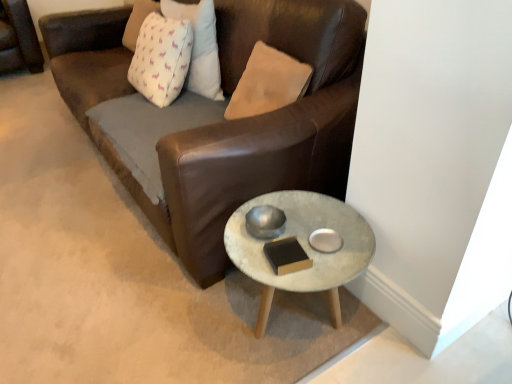
Image resolution: width=512 pixels, height=384 pixels. What do you see at coordinates (303, 248) in the screenshot?
I see `marble-coated coffee table at lower right` at bounding box center [303, 248].

Identify the location of marble-coated coffee table at lower right. The height and width of the screenshot is (384, 512). (303, 248).

The image size is (512, 384). In order to click on white fabric pillow at upper left in this screenshot , I will do `click(200, 46)`.

What do you see at coordinates (200, 46) in the screenshot?
I see `white fabric pillow at upper left` at bounding box center [200, 46].

Where is `marble-coated coffee table at lower right`? The width and height of the screenshot is (512, 384). marble-coated coffee table at lower right is located at coordinates (303, 248).

Considering the positions of objects marble-coated coffee table at lower right and white fabric pillow at upper left in the image provided, who is more to the right, marble-coated coffee table at lower right or white fabric pillow at upper left?

marble-coated coffee table at lower right.

Considering the relative positions of marble-coated coffee table at lower right and white fabric pillow at upper left in the image provided, is marble-coated coffee table at lower right behind white fabric pillow at upper left?

No, it is not.

Is point (266, 295) farther from camera compared to point (162, 8)?

No, it is not.

From the image's perspective, between marble-coated coffee table at lower right and white fabric pillow at upper left, who is located below?

marble-coated coffee table at lower right appears lower in the image.

From a real-world perspective, is marble-coated coffee table at lower right above or below white fabric pillow at upper left?

In terms of real-world spatial position, marble-coated coffee table at lower right is below white fabric pillow at upper left.

Does marble-coated coffee table at lower right have a greater width compared to white fabric pillow at upper left?

Indeed, marble-coated coffee table at lower right has a greater width compared to white fabric pillow at upper left.

Considering the sizes of objects marble-coated coffee table at lower right and white fabric pillow at upper left in the image provided, who is shorter, marble-coated coffee table at lower right or white fabric pillow at upper left?

Standing shorter between the two is marble-coated coffee table at lower right.

Does marble-coated coffee table at lower right have a smaller size compared to white fabric pillow at upper left?

Incorrect, marble-coated coffee table at lower right is not smaller in size than white fabric pillow at upper left.

Which is correct: marble-coated coffee table at lower right is inside white fabric pillow at upper left, or outside of it?

marble-coated coffee table at lower right is outside white fabric pillow at upper left.

Is there a large distance between marble-coated coffee table at lower right and white fabric pillow at upper left?

No, there isn't a large distance between marble-coated coffee table at lower right and white fabric pillow at upper left.

Is marble-coated coffee table at lower right oriented away from white fabric pillow at upper left?

marble-coated coffee table at lower right does not have its back to white fabric pillow at upper left.

How many degrees apart are the facing directions of marble-coated coffee table at lower right and white fabric pillow at upper left?

The angular difference between marble-coated coffee table at lower right and white fabric pillow at upper left is 3.17 degrees.

This screenshot has height=384, width=512. What are the coordinates of `coffee table on the right of white fabric pillow at upper left` in the screenshot? It's located at (303, 248).

Considering the positions of objects white fabric pillow at upper left and marble-coated coffee table at lower right in the image provided, who is more to the left, white fabric pillow at upper left or marble-coated coffee table at lower right?

Positioned to the left is white fabric pillow at upper left.

Is white fabric pillow at upper left closer to camera compared to marble-coated coffee table at lower right?

No.

Is point (189, 76) positioned in front of point (351, 226)?

No, (189, 76) is further to viewer.

From the image's perspective, who appears lower, white fabric pillow at upper left or marble-coated coffee table at lower right?

marble-coated coffee table at lower right is shown below in the image.

From a real-world perspective, is white fabric pillow at upper left above or below marble-coated coffee table at lower right?

white fabric pillow at upper left is situated higher than marble-coated coffee table at lower right in the real world.

Can you confirm if white fabric pillow at upper left is wider than marble-coated coffee table at lower right?

In fact, white fabric pillow at upper left might be narrower than marble-coated coffee table at lower right.

Who is shorter, white fabric pillow at upper left or marble-coated coffee table at lower right?

Standing shorter between the two is marble-coated coffee table at lower right.

Who is smaller, white fabric pillow at upper left or marble-coated coffee table at lower right?

white fabric pillow at upper left is smaller.

Is marble-coated coffee table at lower right completely or partially inside white fabric pillow at upper left?

No, white fabric pillow at upper left does not contain marble-coated coffee table at lower right.

Is there a large distance between white fabric pillow at upper left and marble-coated coffee table at lower right?

They are positioned close to each other.

Is white fabric pillow at upper left facing towards marble-coated coffee table at lower right?

No, white fabric pillow at upper left is not oriented towards marble-coated coffee table at lower right.

How distant is white fabric pillow at upper left from marble-coated coffee table at lower right?

white fabric pillow at upper left is 35.39 inches away from marble-coated coffee table at lower right.

In order to click on pillow above the marble-coated coffee table at lower right (from a real-world perspective) in this screenshot , I will do `click(200, 46)`.

Image resolution: width=512 pixels, height=384 pixels. In the image, there is a white fabric pillow at upper left. In order to click on coffee table below it (from the image's perspective) in this screenshot , I will do `click(303, 248)`.

The height and width of the screenshot is (384, 512). Find the location of `pillow behind the marble-coated coffee table at lower right`. pillow behind the marble-coated coffee table at lower right is located at coordinates (200, 46).